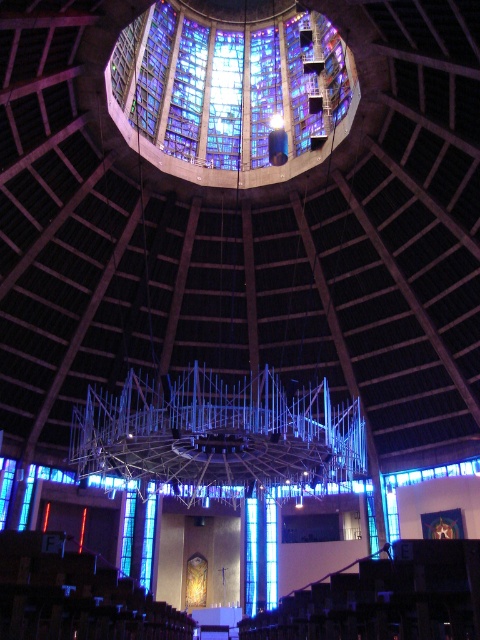
You are an architect designing a new cathedral and want to ensure that the transparent glass window at center and the blue glass window at center are positioned in a way that they are not too far apart. According to the design specifications, the maximum allowed distance between them should be 20 meters. Based on the image provided, will the current placement meet this requirement?

The transparent glass window at center is 21.60 meters from the blue glass window at center. Since the maximum allowed distance is 20 meters, the current placement exceeds the requirement by 1.60 meters and will not meet the specifications.

You are an architect designing a new building and want to ensure the stained glass at center and transparent glass window at center are proportionally balanced. Given their widths, which one should be placed in a more prominent position to maintain visual harmony?

The stained glass at center should be placed in a more prominent position since its width surpasses that of the transparent glass window at center, making it visually dominant.